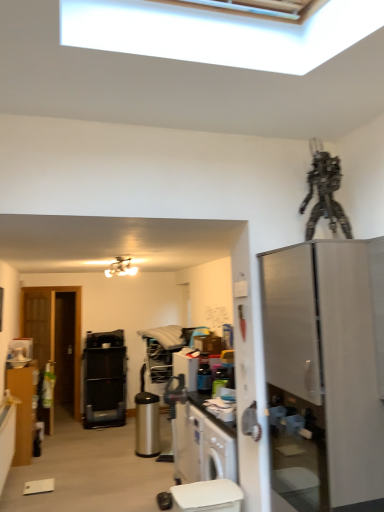
Question: Should I look upward or downward to see transparent glass door at left?

Choices:
 (A) down
 (B) up

Answer: (A)

Question: From the image's perspective, is stainless steel refrigerator at right over white glossy toilet bowl at lower center?

Choices:
 (A) yes
 (B) no

Answer: (A)

Question: Does stainless steel refrigerator at right have a lesser height compared to white glossy toilet bowl at lower center?

Choices:
 (A) no
 (B) yes

Answer: (A)

Question: Can you confirm if stainless steel refrigerator at right is positioned to the right of white glossy toilet bowl at lower center?

Choices:
 (A) no
 (B) yes

Answer: (B)

Question: Does stainless steel refrigerator at right lie behind white glossy toilet bowl at lower center?

Choices:
 (A) no
 (B) yes

Answer: (A)

Question: Does stainless steel refrigerator at right have a lesser width compared to white glossy toilet bowl at lower center?

Choices:
 (A) yes
 (B) no

Answer: (B)

Question: From the image's perspective, is stainless steel refrigerator at right beneath white glossy toilet bowl at lower center?

Choices:
 (A) no
 (B) yes

Answer: (A)

Question: Is matte brown cabinet at left at the back of white matte light fixture at upper center?

Choices:
 (A) no
 (B) yes

Answer: (A)

Question: Is white matte light fixture at upper center to the left of matte brown cabinet at left from the viewer's perspective?

Choices:
 (A) yes
 (B) no

Answer: (B)

Question: Considering the relative positions of white matte light fixture at upper center and matte brown cabinet at left in the image provided, is white matte light fixture at upper center behind matte brown cabinet at left?

Choices:
 (A) no
 (B) yes

Answer: (A)

Question: From the image's perspective, is white matte light fixture at upper center above matte brown cabinet at left?

Choices:
 (A) no
 (B) yes

Answer: (B)

Question: Are white matte light fixture at upper center and matte brown cabinet at left making contact?

Choices:
 (A) yes
 (B) no

Answer: (B)

Question: Is white matte light fixture at upper center positioned beyond the bounds of matte brown cabinet at left?

Choices:
 (A) yes
 (B) no

Answer: (A)

Question: From the image's perspective, is matte brown cabinet at left on metallic robot at upper right?

Choices:
 (A) yes
 (B) no

Answer: (B)